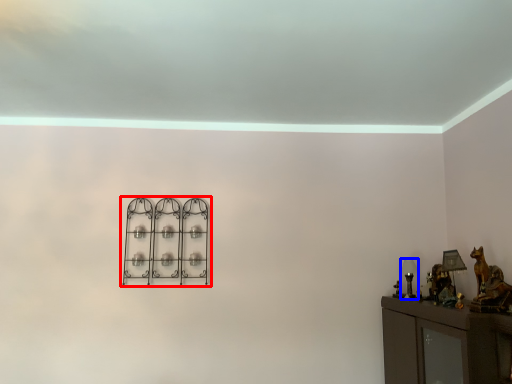
Question: Which point is further to the camera, shelf (highlighted by a red box) or table lamp (highlighted by a blue box)?

Choices:
 (A) shelf
 (B) table lamp

Answer: (A)